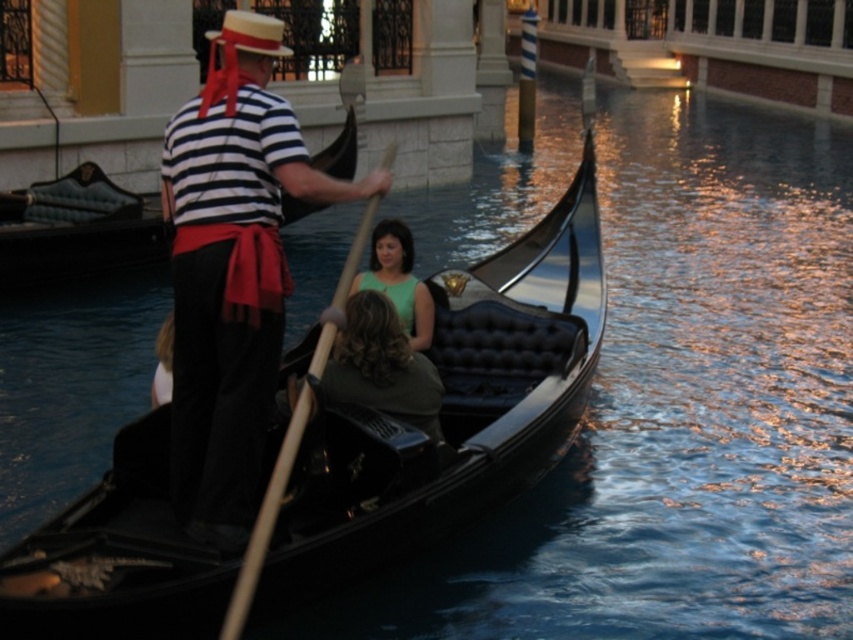
Question: Estimate the real-world distances between objects in this image. Which object is closer to the matte black gondolier at center?

Choices:
 (A) green matte dress at center
 (B) black polished wood boat at center

Answer: (B)

Question: Does black polished wood boat at center have a greater width compared to matte black gondolier at center?

Choices:
 (A) yes
 (B) no

Answer: (A)

Question: Is black polished wood boat at center wider than matte black gondolier at center?

Choices:
 (A) no
 (B) yes

Answer: (B)

Question: Which of these objects is positioned farthest from the matte black gondolier at center?

Choices:
 (A) black polished wood boat at center
 (B) green matte dress at center

Answer: (B)

Question: Does black polished wood boat at center appear over green matte dress at center?

Choices:
 (A) no
 (B) yes

Answer: (A)

Question: Among these objects, which one is farthest from the camera?

Choices:
 (A) matte black gondolier at center
 (B) green matte dress at center
 (C) black polished wood boat at center

Answer: (B)